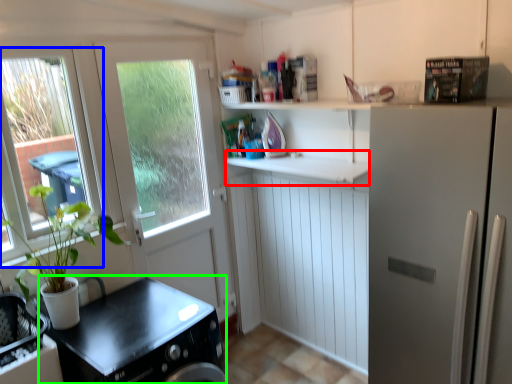
Question: Which object is positioned closest to counter top (highlighted by a red box)? Select from window (highlighted by a blue box) and counter top (highlighted by a green box).

Choices:
 (A) window
 (B) counter top

Answer: (B)